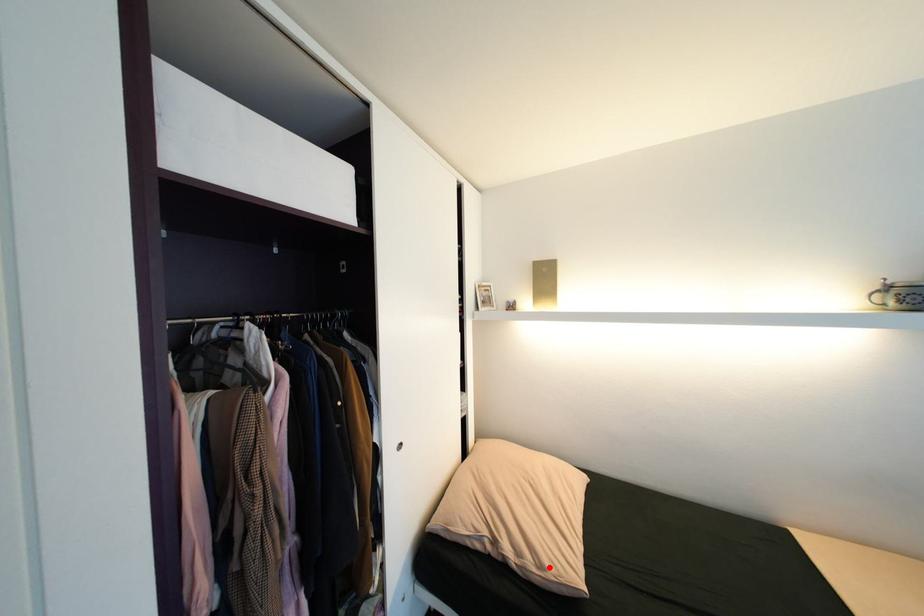
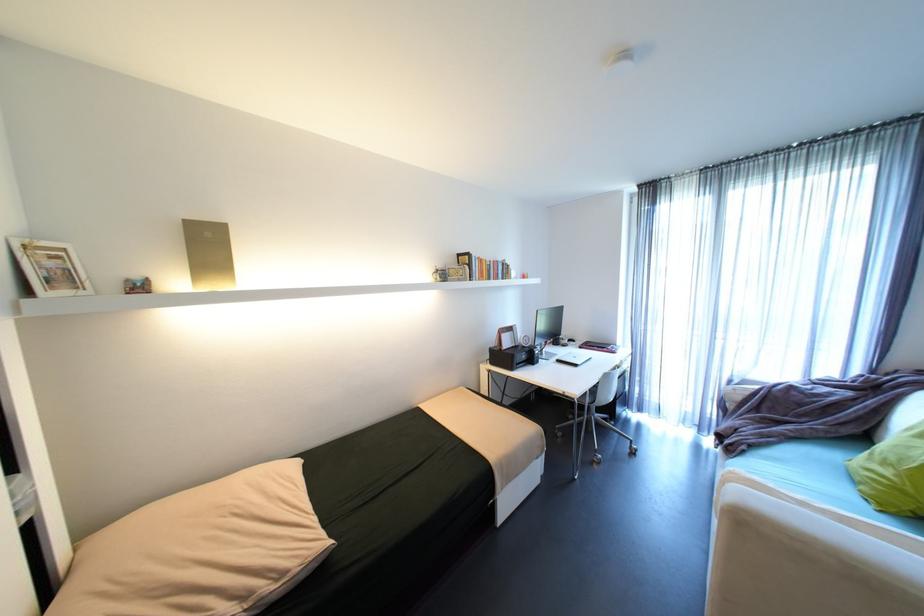
Locate, in the second image, the point that corresponds to the highlighted location in the first image.

(289, 575)